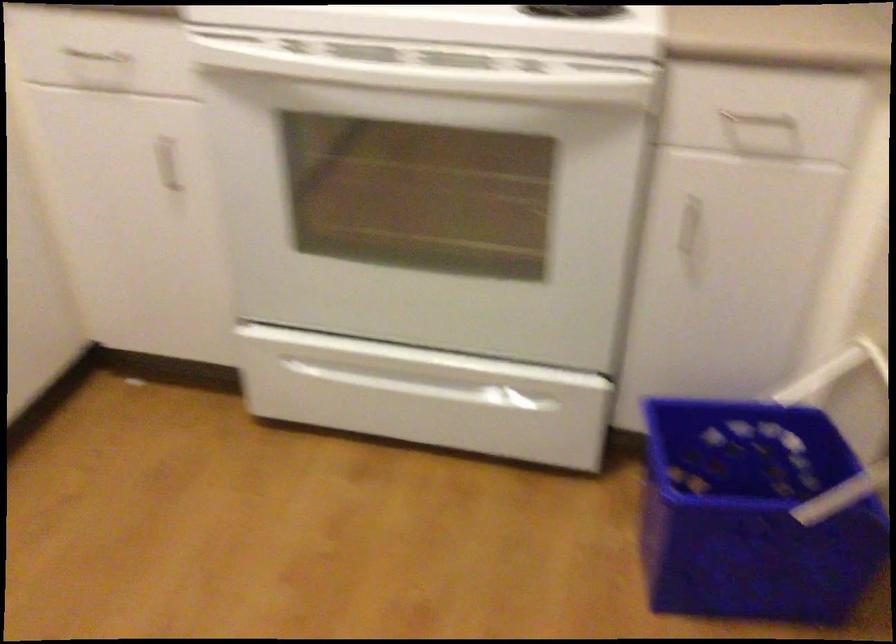
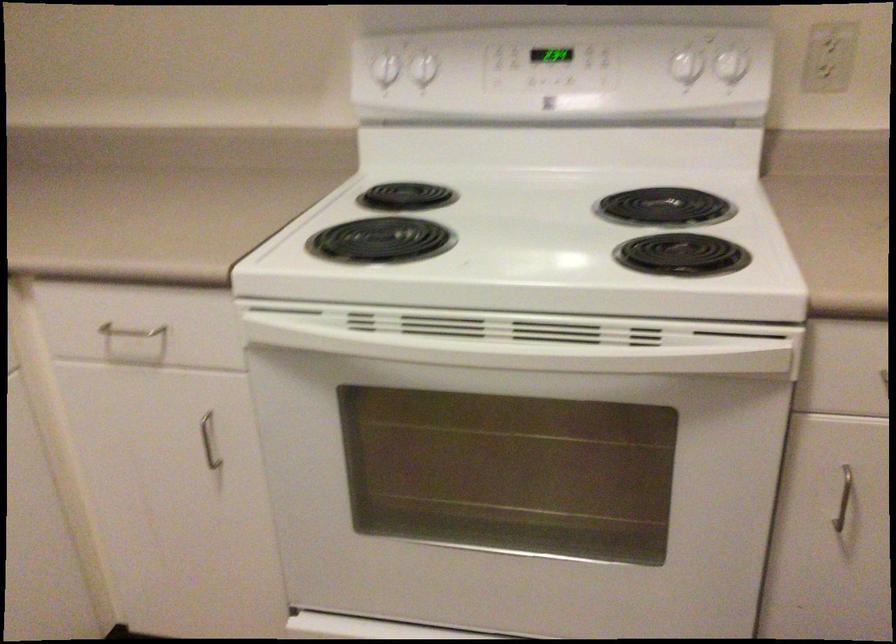
Find the pixel in the second image that matches [691,228] in the first image.

(842, 498)